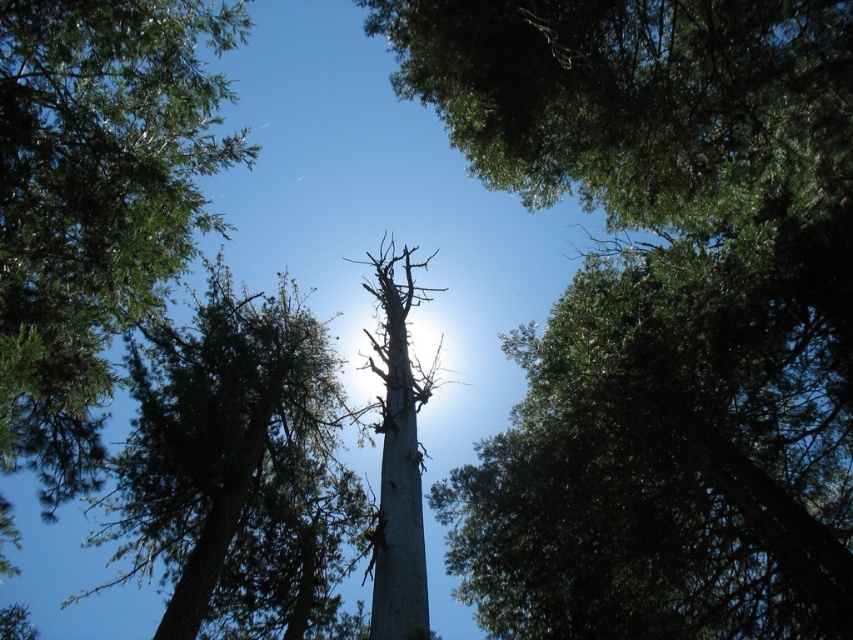
Question: Does green textured tree at center appear on the left side of gray bark tree at center?

Choices:
 (A) yes
 (B) no

Answer: (A)

Question: Which object is farther from the camera taking this photo?

Choices:
 (A) gray bark tree at center
 (B) smooth gray trunk at center
 (C) green textured tree at center
 (D) green leafy tree at upper left

Answer: (C)

Question: Does green leafy tree at upper left have a smaller size compared to green textured tree at center?

Choices:
 (A) no
 (B) yes

Answer: (B)

Question: Which object is the farthest from the smooth gray trunk at center?

Choices:
 (A) green textured tree at center
 (B) green leafy tree at upper left
 (C) gray bark tree at center

Answer: (B)

Question: Is green leafy tree at upper left positioned in front of gray bark tree at center?

Choices:
 (A) yes
 (B) no

Answer: (B)

Question: Which point is farther to the camera?

Choices:
 (A) (418, 476)
 (B) (200, 340)
 (C) (61, 481)

Answer: (B)